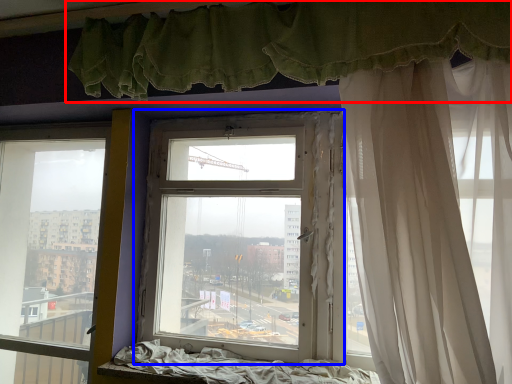
Question: Among these objects, which one is nearest to the camera, curtain (highlighted by a red box) or window (highlighted by a blue box)?

Choices:
 (A) curtain
 (B) window

Answer: (A)